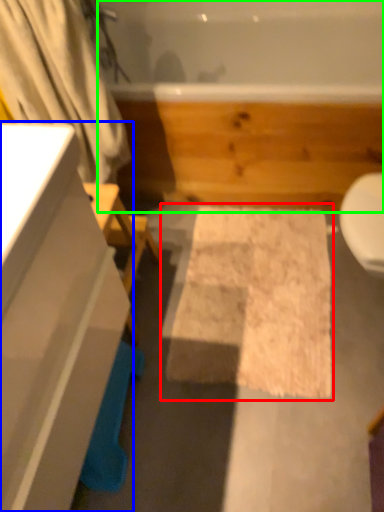
Question: Based on their relative distances, which object is farther from bath mat (highlighted by a red box)? Choose from bathroom cabinet (highlighted by a blue box) and jacuzzi (highlighted by a green box).

Choices:
 (A) bathroom cabinet
 (B) jacuzzi

Answer: (A)